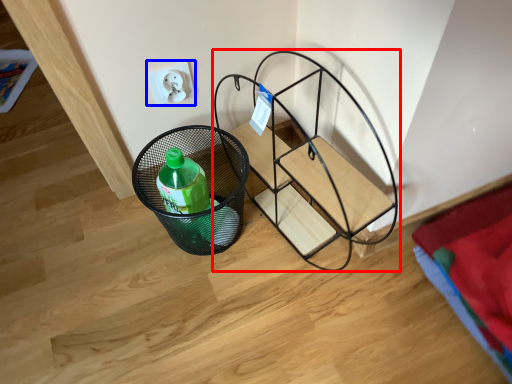
Question: Which point is closer to the camera, furniture (highlighted by a red box) or electric outlet (highlighted by a blue box)?

Choices:
 (A) furniture
 (B) electric outlet

Answer: (A)